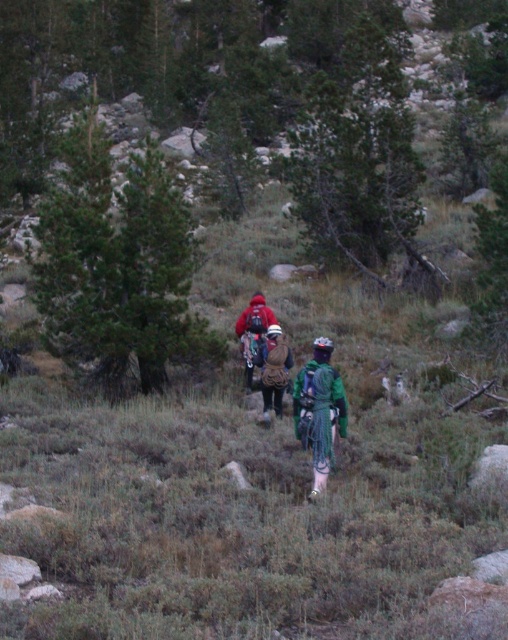
Question: Which point appears farthest from the camera in this image?

Choices:
 (A) (326, 394)
 (B) (243, 323)
 (C) (271, 380)

Answer: (B)

Question: Estimate the real-world distances between objects in this image. Which object is closer to the green fabric backpack at center?

Choices:
 (A) matte red jacket at center
 (B) brown fuzzy jacket at center

Answer: (B)

Question: Considering the relative positions of brown fuzzy jacket at center and matte red jacket at center in the image provided, where is brown fuzzy jacket at center located with respect to matte red jacket at center?

Choices:
 (A) below
 (B) above

Answer: (A)

Question: Which point appears farthest from the camera in this image?

Choices:
 (A) (251, 308)
 (B) (299, 426)

Answer: (A)

Question: Can you confirm if brown fuzzy jacket at center is positioned below matte red jacket at center?

Choices:
 (A) yes
 (B) no

Answer: (A)

Question: Is green fabric backpack at center bigger than matte red jacket at center?

Choices:
 (A) no
 (B) yes

Answer: (A)